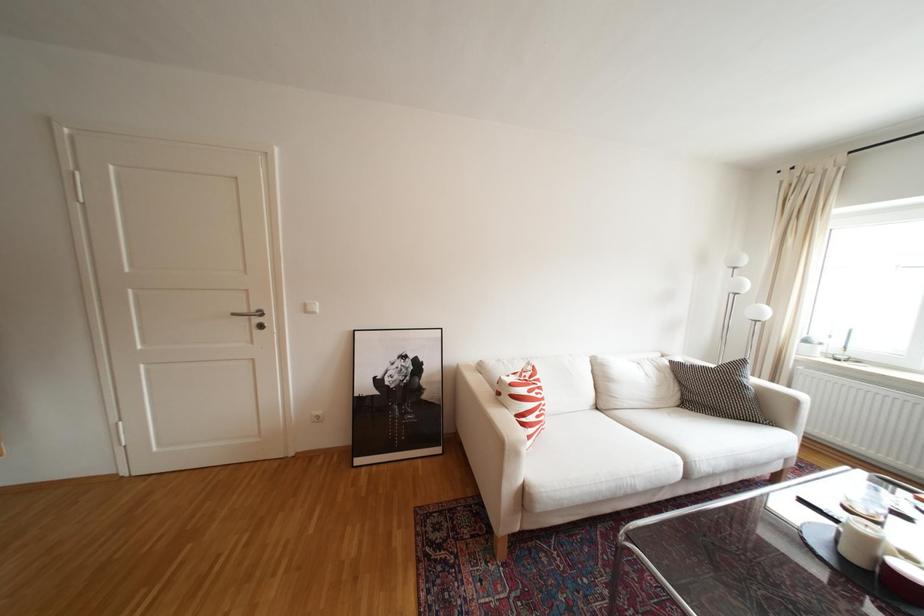
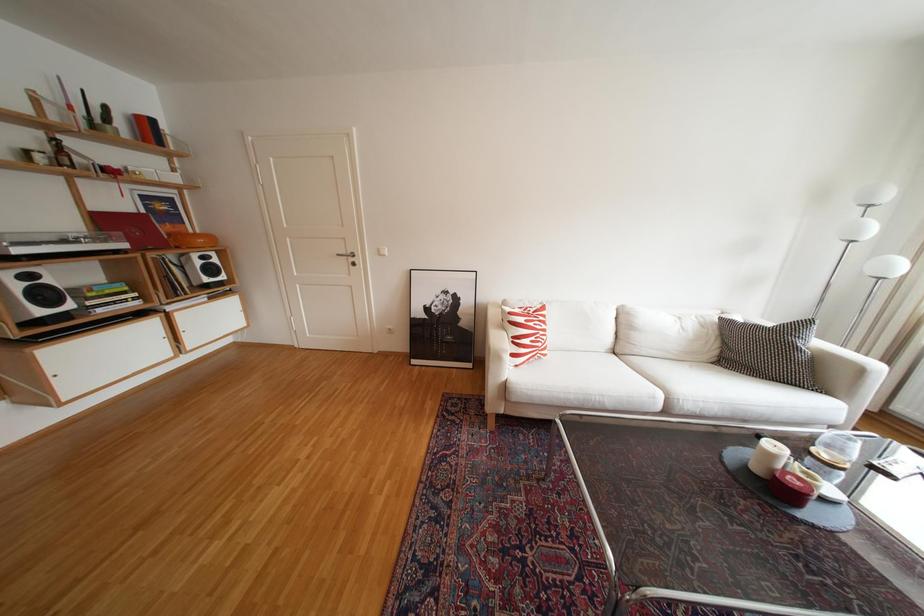
Question: The camera is either moving clockwise (left) or counter-clockwise (right) around the object. The first image is from the beginning of the video and the second image is from the end. Is the camera moving left or right when shooting the video?

Choices:
 (A) Left
 (B) Right

Answer: (B)